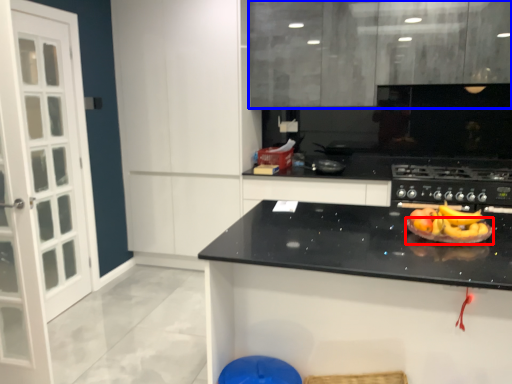
Question: Which object is further to the camera taking this photo, paper plate (highlighted by a red box) or cabinetry (highlighted by a blue box)?

Choices:
 (A) paper plate
 (B) cabinetry

Answer: (B)